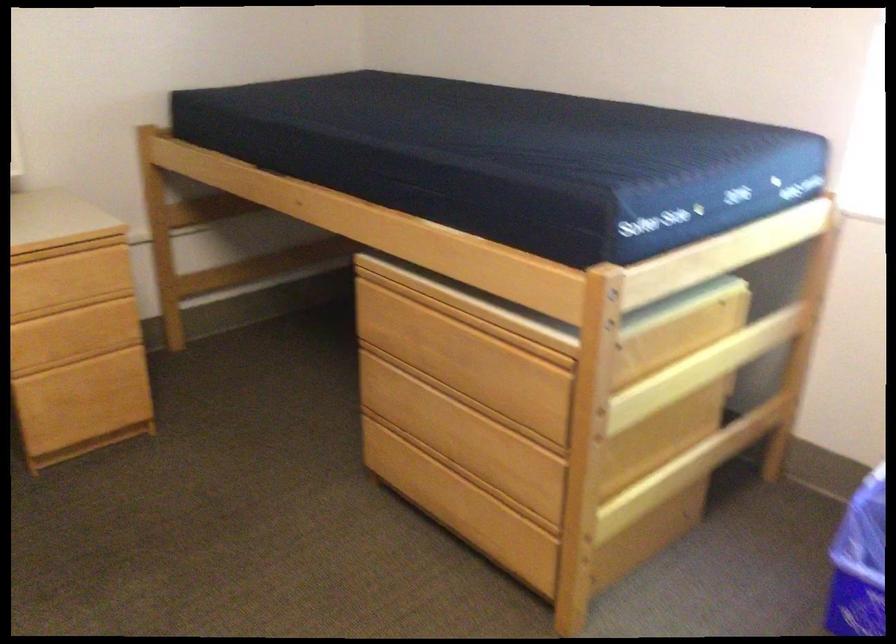
Where is `blue plastic bin`? The height and width of the screenshot is (644, 896). blue plastic bin is located at coordinates (858, 563).